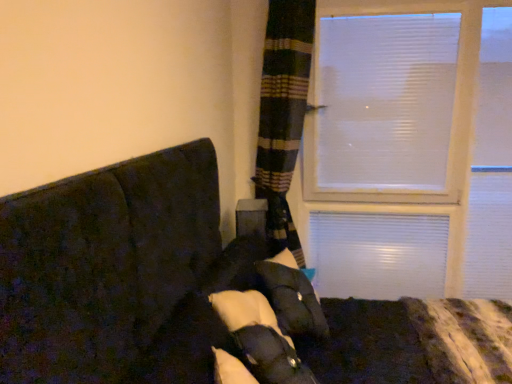
Question: Considering the positions of point (314, 329) and point (208, 180), is point (314, 329) closer or farther from the camera than point (208, 180)?

Choices:
 (A) closer
 (B) farther

Answer: (A)

Question: In terms of height, does white soft pillow at center look taller or shorter compared to dark fabric couch at left?

Choices:
 (A) short
 (B) tall

Answer: (A)

Question: Based on their positions, is white soft pillow at center located to the left or right of dark fabric couch at left?

Choices:
 (A) right
 (B) left

Answer: (B)

Question: Is point (293, 279) closer or farther from the camera than point (281, 317)?

Choices:
 (A) closer
 (B) farther

Answer: (B)

Question: From the image's perspective, is dark fabric couch at left positioned above or below white soft pillow at center?

Choices:
 (A) below
 (B) above

Answer: (A)

Question: Relative to white soft pillow at center, is dark fabric couch at left in front or behind?

Choices:
 (A) front
 (B) behind

Answer: (A)

Question: From a real-world perspective, is dark fabric couch at left above or below white soft pillow at center?

Choices:
 (A) below
 (B) above

Answer: (A)